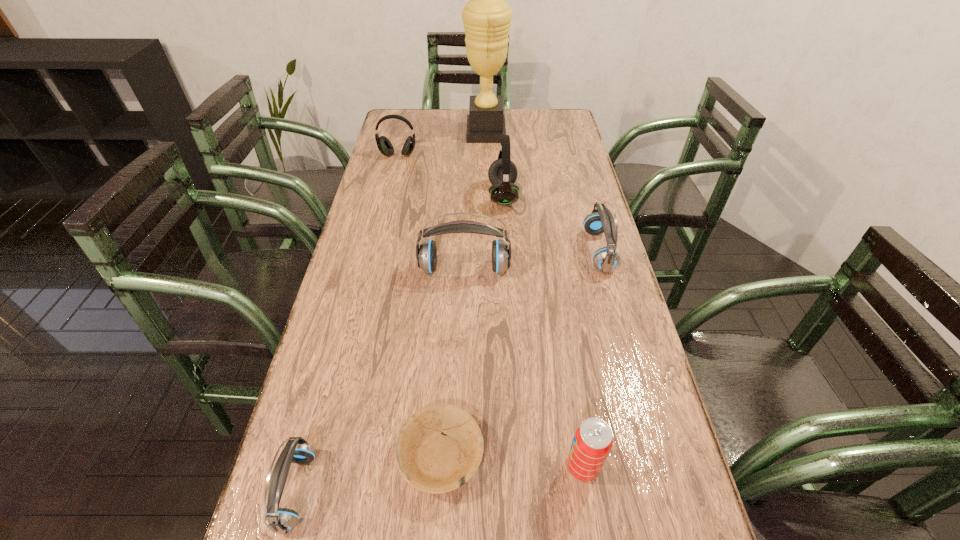
Where is `yellow trophy cup`? Image resolution: width=960 pixels, height=540 pixels. yellow trophy cup is located at coordinates (486, 17).

This screenshot has width=960, height=540. I want to click on the farthest object, so [x=486, y=17].

Image resolution: width=960 pixels, height=540 pixels. Identify the location of the right black headset. (502, 173).

You are a GUI agent. You are given a task and a screenshot of the screen. Output one action in this format:
    pyautogui.click(x=<x>, y=<y>)
    Task: Click on the sixth nearest object
    This screenshot has height=540, width=960.
    Given the screenshot: What is the action you would take?
    pyautogui.click(x=502, y=173)

In order to click on the second blue headset from left to right in this screenshot , I will do tap(426, 256).

Where is `the farthest headset`? the farthest headset is located at coordinates (384, 145).

The image size is (960, 540). I want to click on the second farthest object, so click(x=384, y=145).

The height and width of the screenshot is (540, 960). I want to click on the second object from right to left, so point(593,440).

Identify the location of the rightmost headset. (601, 220).

Identify the location of the second biggest blue headset. This screenshot has height=540, width=960. (601, 220).